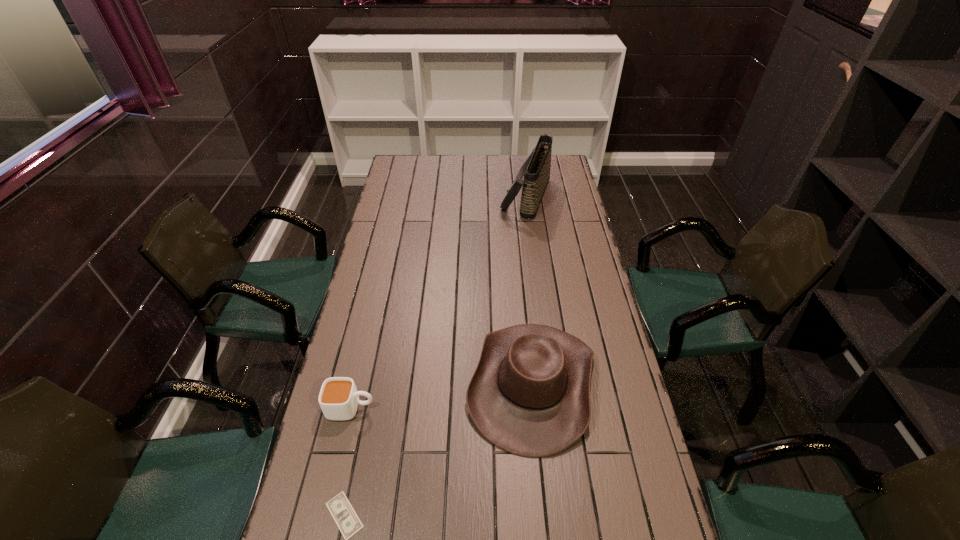
Where is `empty space that is in between the handbag and the cup`? empty space that is in between the handbag and the cup is located at coordinates (439, 302).

Where is `object that can be found as the second closest to the cowboy hat`? This screenshot has height=540, width=960. object that can be found as the second closest to the cowboy hat is located at coordinates (339, 398).

Select which object is the third closest to the handbag. Please provide its 2D coordinates. Your answer should be formatted as a tuple, i.e. [(x, y)], where the tuple contains the x and y coordinates of a point satisfying the conditions above.

[(340, 508)]

You are a GUI agent. You are given a task and a screenshot of the screen. Output one action in this format:
    pyautogui.click(x=<x>, y=<y>)
    Task: Click on the vacant space that satisfies the following two spatial constraints: 1. on the back side of the cowboy hat; 2. on the left side of the farthest object
    The height and width of the screenshot is (540, 960).
    Given the screenshot: What is the action you would take?
    pyautogui.click(x=515, y=196)